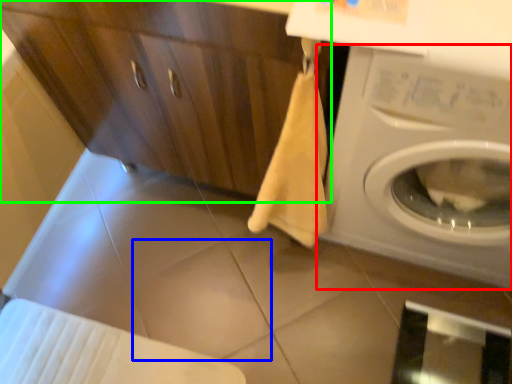
Question: Which is farther away from washing machine (highlighted by a red box)? tile (highlighted by a blue box) or dresser (highlighted by a green box)?

Choices:
 (A) tile
 (B) dresser

Answer: (A)